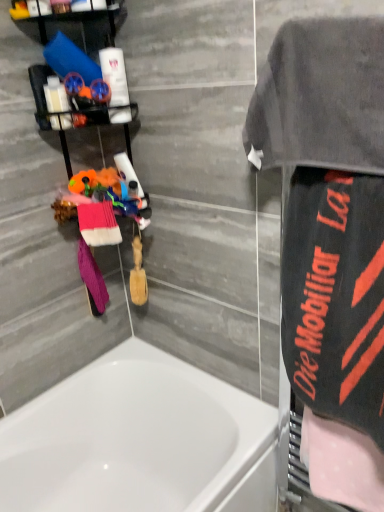
Question: Is black fabric towel at right, placed as the fourth beach towel when sorted from left to right, located within pink polka dot towel at right, the 1th beach towel when ordered from right to left?

Choices:
 (A) yes
 (B) no

Answer: (B)

Question: Can you confirm if pink polka dot towel at right, acting as the 5th beach towel starting from the left, is taller than black fabric towel at right, placed as the fourth beach towel when sorted from left to right?

Choices:
 (A) yes
 (B) no

Answer: (B)

Question: From a real-world perspective, is pink polka dot towel at right, the 1th beach towel when ordered from right to left, located higher than black fabric towel at right, placed as the fourth beach towel when sorted from left to right?

Choices:
 (A) no
 (B) yes

Answer: (A)

Question: From a real-world perspective, does pink polka dot towel at right, the 1th beach towel when ordered from right to left, sit lower than black fabric towel at right, marked as the 2th beach towel in a right-to-left arrangement?

Choices:
 (A) yes
 (B) no

Answer: (A)

Question: From the image's perspective, is pink polka dot towel at right, the 1th beach towel when ordered from right to left, above black fabric towel at right, marked as the 2th beach towel in a right-to-left arrangement?

Choices:
 (A) yes
 (B) no

Answer: (B)

Question: Can you confirm if pink polka dot towel at right, the 1th beach towel when ordered from right to left, is thinner than black fabric towel at right, marked as the 2th beach towel in a right-to-left arrangement?

Choices:
 (A) yes
 (B) no

Answer: (A)

Question: From the image's perspective, is matte plastic bottles at upper left, the 2th toiletry when ordered from right to left, under gray terry cloth towel at upper right?

Choices:
 (A) yes
 (B) no

Answer: (B)

Question: Considering the relative sizes of matte plastic bottles at upper left, the 1th toiletry from the left, and gray terry cloth towel at upper right in the image provided, is matte plastic bottles at upper left, the 1th toiletry from the left, bigger than gray terry cloth towel at upper right?

Choices:
 (A) yes
 (B) no

Answer: (B)

Question: From a real-world perspective, is matte plastic bottles at upper left, the 2th toiletry when ordered from right to left, on gray terry cloth towel at upper right?

Choices:
 (A) yes
 (B) no

Answer: (A)

Question: Does matte plastic bottles at upper left, the 1th toiletry from the left, contain gray terry cloth towel at upper right?

Choices:
 (A) no
 (B) yes

Answer: (A)

Question: From a real-world perspective, is matte plastic bottles at upper left, the 2th toiletry when ordered from right to left, below gray terry cloth towel at upper right?

Choices:
 (A) no
 (B) yes

Answer: (A)

Question: Can you confirm if matte plastic bottles at upper left, the 2th toiletry when ordered from right to left, is thinner than gray terry cloth towel at upper right?

Choices:
 (A) yes
 (B) no

Answer: (A)

Question: Considering the relative sizes of matte plastic bottles at upper left, the 1th toiletry from the left, and white glossy bathtub at lower left in the image provided, is matte plastic bottles at upper left, the 1th toiletry from the left, thinner than white glossy bathtub at lower left?

Choices:
 (A) yes
 (B) no

Answer: (A)